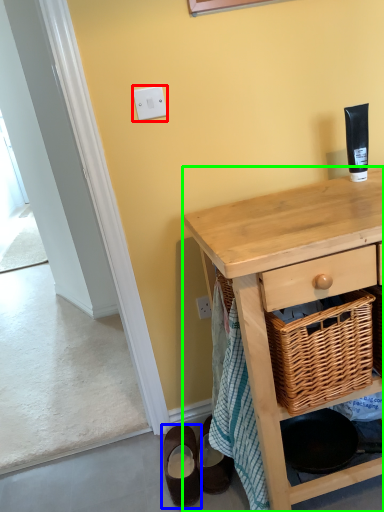
Question: Which object is the farthest from light switch (highlighted by a red box)? Choose among these: footwear (highlighted by a blue box) or desk (highlighted by a green box).

Choices:
 (A) footwear
 (B) desk

Answer: (A)